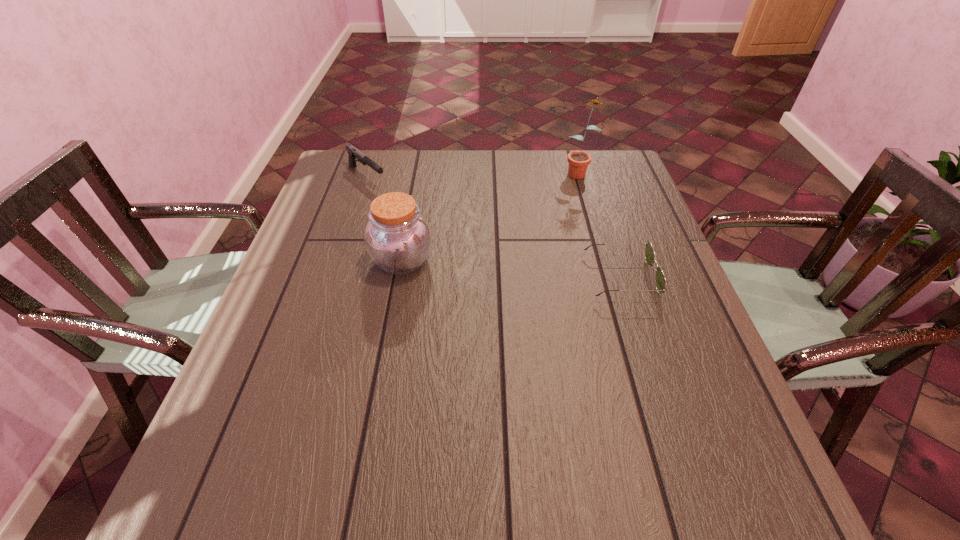
At what (x,y) coordinates should I click in order to perform the action: click on free point at the far edge. Please return your answer as a coordinate pair (x, y). The width and height of the screenshot is (960, 540). Looking at the image, I should click on (517, 172).

The height and width of the screenshot is (540, 960). In the image, there is a desktop. Identify the location of blank space at the near edge. (353, 406).

This screenshot has width=960, height=540. Find the location of `vacant space at the left edge of the desktop`. vacant space at the left edge of the desktop is located at coordinates (297, 332).

At what (x,y) coordinates should I click in order to perform the action: click on vacant space at the right edge. Please return your answer as a coordinate pair (x, y). Looking at the image, I should click on (630, 233).

This screenshot has height=540, width=960. In order to click on free space at the far left corner of the desktop in this screenshot , I will do `click(336, 159)`.

Find the location of a particular element. Image resolution: width=960 pixels, height=540 pixels. free point at the far right corner is located at coordinates point(630,171).

Identify the location of free spot at the near right corner of the desktop. (704, 426).

You are a GUI agent. You are given a task and a screenshot of the screen. Output one action in this format:
    pyautogui.click(x=<x>, y=<y>)
    Task: Click on the unoccupied area between the sunflower and the leftmost object
    
    Given the screenshot: What is the action you would take?
    pyautogui.click(x=472, y=174)

I want to click on free area in between the tallest object and the gun, so click(x=472, y=174).

Locate an element on the screen. The width and height of the screenshot is (960, 540). free space that is in between the third tallest object and the shortest object is located at coordinates (493, 226).